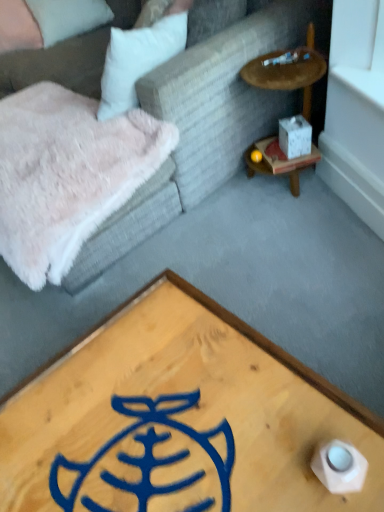
Question: In terms of width, does wooden coffee table at center look wider or thinner when compared to white matte cube at right?

Choices:
 (A) thin
 (B) wide

Answer: (B)

Question: Does point (195, 378) appear closer or farther from the camera than point (246, 158)?

Choices:
 (A) closer
 (B) farther

Answer: (A)

Question: Based on their relative distances, which object is farther from the wooden coffee table at center?

Choices:
 (A) wooden at right
 (B) white matte cube at right
 (C) white fluffy pillow at upper left, which is the 1th pillow in left-to-right order
 (D) beige fabric pillow at upper left, the 1th pillow in the right-to-left sequence
 (E) velvet fabric couch at upper left

Answer: (C)

Question: Estimate the real-world distances between objects in this image. Which object is farther from the velvet fabric couch at upper left?

Choices:
 (A) white matte cube at right
 (B) wooden at right
 (C) fuzzy pink blanket at upper left
 (D) wooden coffee table at center
 (E) white fluffy pillow at upper left, which is the 1th pillow in left-to-right order

Answer: (E)